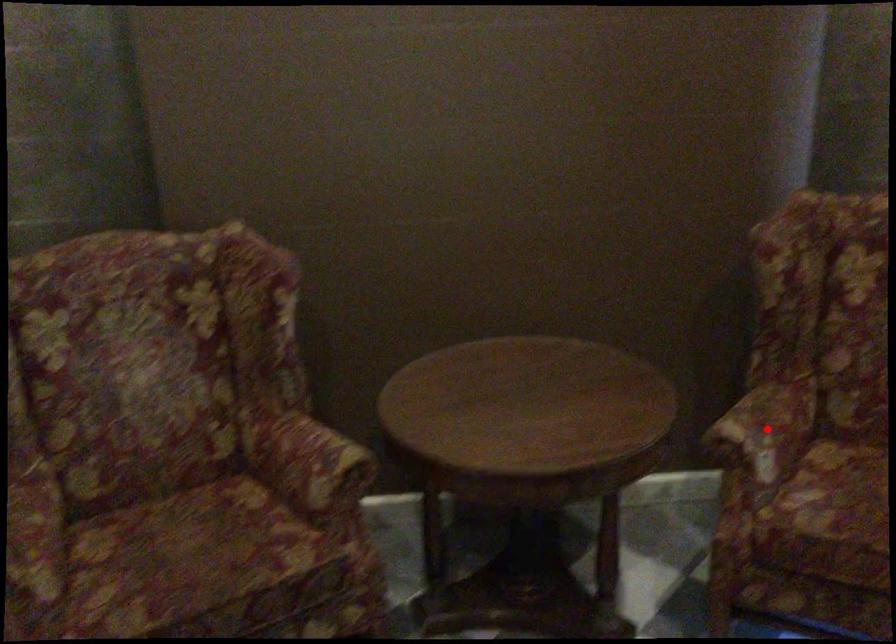
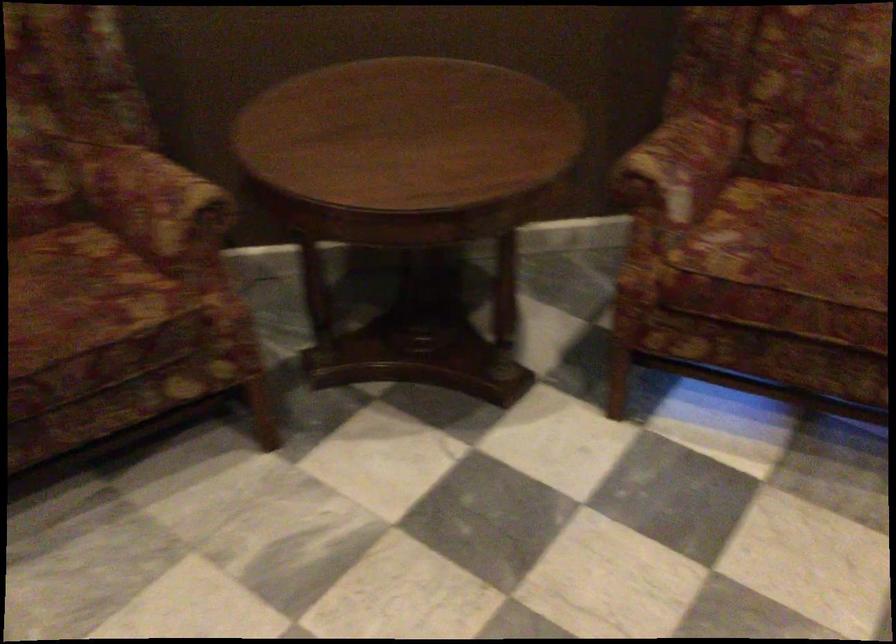
The point at the highlighted location is marked in the first image. Where is the corresponding point in the second image?

(679, 164)